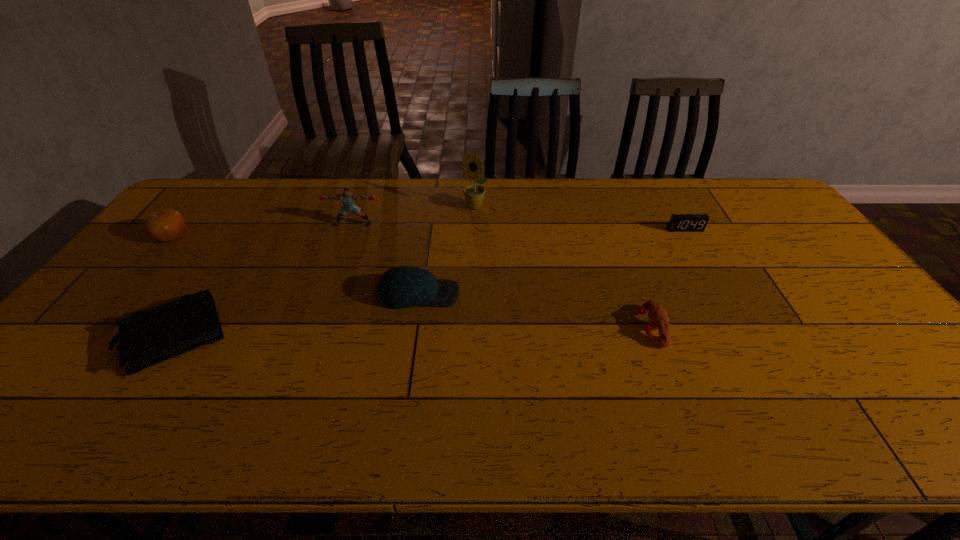
Locate an element on the screen. The width and height of the screenshot is (960, 540). vacant point located between the shorter puncher and the rightmost object is located at coordinates (667, 278).

Locate an element on the screen. This screenshot has width=960, height=540. vacant region between the second object from left to right and the sixth object from left to right is located at coordinates (412, 332).

This screenshot has width=960, height=540. Find the location of `free space that is in between the nearer puncher and the farthest object`. free space that is in between the nearer puncher and the farthest object is located at coordinates (563, 267).

Where is `vacant point located between the sunflower and the leftmost object`? vacant point located between the sunflower and the leftmost object is located at coordinates (324, 221).

Identify the location of free space between the fifth object from right to left and the baseball cap. This screenshot has height=540, width=960. (386, 259).

This screenshot has width=960, height=540. I want to click on free space between the baseball cap and the sunflower, so click(446, 251).

Identify the location of vacant area between the second object from left to right and the clementine. (173, 286).

The width and height of the screenshot is (960, 540). Identify the location of free spot between the leftmost object and the rightmost object. (428, 233).

Locate an element on the screen. object that is the sixth closest to the baseball cap is located at coordinates (678, 222).

Choose which object is the fourth nearest neighbor to the clementine. Please provide its 2D coordinates. Your answer should be formatted as a tuple, i.e. [(x, y)], where the tuple contains the x and y coordinates of a point satisfying the conditions above.

[(474, 194)]